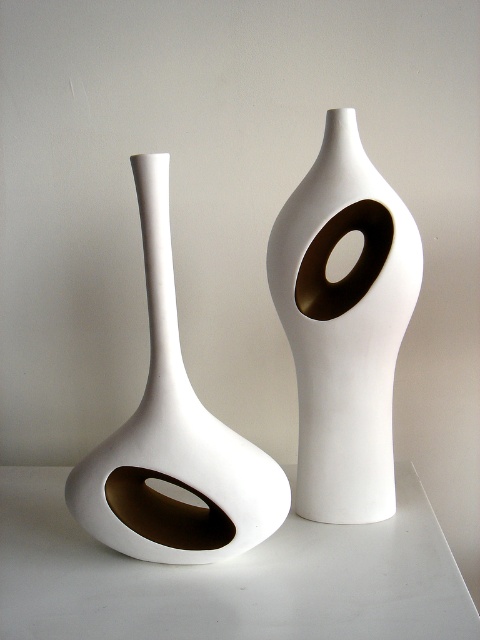
Is point (371, 460) positioned before point (354, 264)?

Yes, point (371, 460) is closer to viewer.

Does white glossy vase at center appear on the right side of matte gold ring at center?

No, white glossy vase at center is not to the right of matte gold ring at center.

The height and width of the screenshot is (640, 480). What are the coordinates of `white glossy vase at center` in the screenshot? It's located at [x=345, y=324].

Which of these two, white matte vase at left or matte gold ring at center, stands shorter?

With less height is matte gold ring at center.

Can you confirm if white matte vase at left is shorter than matte gold ring at center?

No, white matte vase at left is not shorter than matte gold ring at center.

Is point (72, 472) more distant than point (349, 300)?

No, it is not.

This screenshot has height=640, width=480. Find the location of `white matte vase at left`. white matte vase at left is located at coordinates (173, 438).

Is white matte table at lower left wider than matte gold ring at center?

Yes, white matte table at lower left is wider than matte gold ring at center.

Which is behind, point (240, 609) or point (331, 244)?

The point (331, 244) is more distant.

Who is more forward, (403, 552) or (314, 301)?

Positioned in front is point (403, 552).

Locate an element on the screen. This screenshot has height=640, width=480. white matte table at lower left is located at coordinates (228, 577).